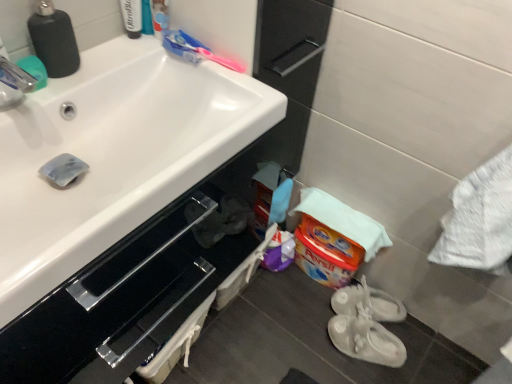
Locate an element on the screen. This screenshot has height=384, width=512. vacant area that is in front of translucent plastic toothbrush at upper center, arranged as the first toiletry when viewed from the right is located at coordinates (136, 59).